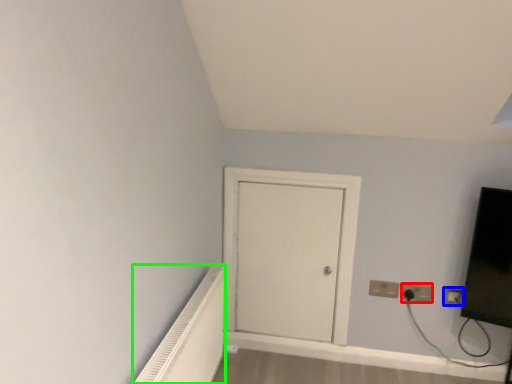
Question: Based on their relative distances, which object is farther from electric outlet (highlighted by a red box)? Choose from electric outlet (highlighted by a blue box) and radiator (highlighted by a green box).

Choices:
 (A) electric outlet
 (B) radiator

Answer: (B)